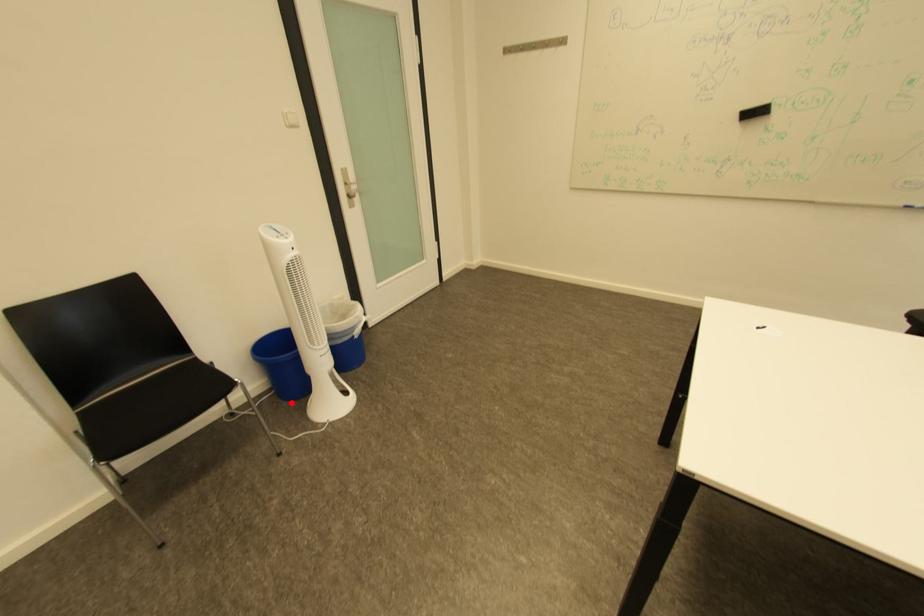
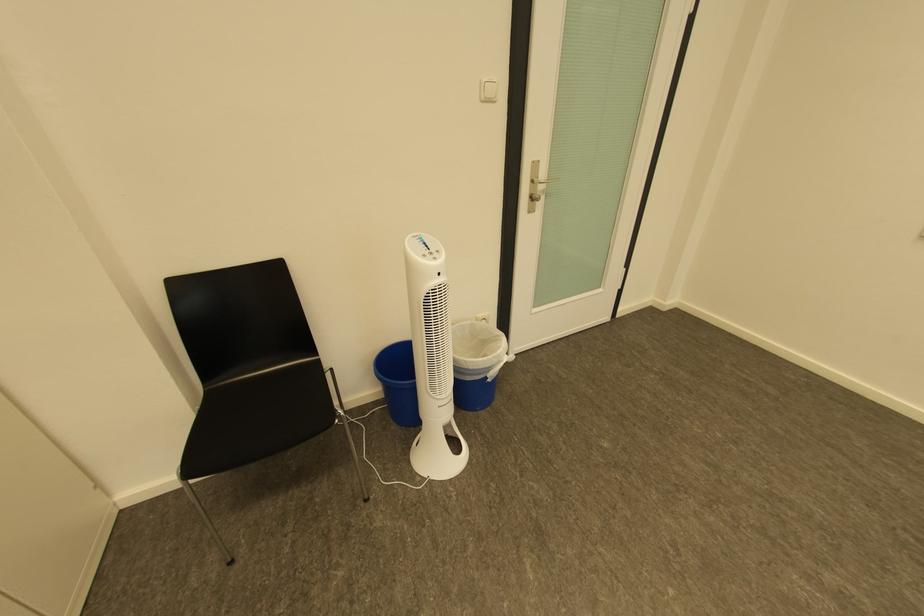
The point at the highlighted location is marked in the first image. Where is the corresponding point in the second image?

(402, 422)